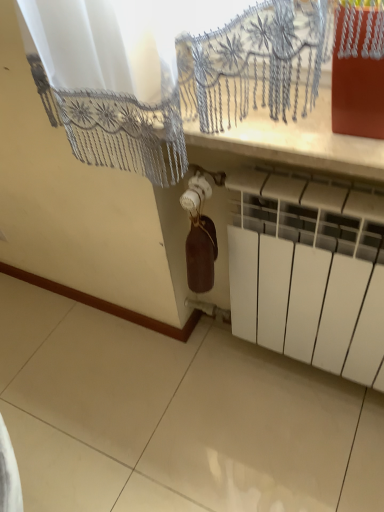
Question: Should I look upward or downward to see brown matte wine bottle at center?

Choices:
 (A) down
 (B) up

Answer: (B)

Question: Does white matte radiator at lower right have a greater width compared to brown matte wine bottle at center?

Choices:
 (A) yes
 (B) no

Answer: (A)

Question: Does white matte radiator at lower right lie in front of brown matte wine bottle at center?

Choices:
 (A) yes
 (B) no

Answer: (A)

Question: Does white matte radiator at lower right appear on the left side of brown matte wine bottle at center?

Choices:
 (A) no
 (B) yes

Answer: (A)

Question: Does white matte radiator at lower right have a greater height compared to brown matte wine bottle at center?

Choices:
 (A) yes
 (B) no

Answer: (A)

Question: From a real-world perspective, is white matte radiator at lower right under brown matte wine bottle at center?

Choices:
 (A) yes
 (B) no

Answer: (A)

Question: Can you confirm if white matte radiator at lower right is shorter than brown matte wine bottle at center?

Choices:
 (A) no
 (B) yes

Answer: (A)

Question: Is brown matte wine bottle at center turned away from white matte radiator at lower right?

Choices:
 (A) yes
 (B) no

Answer: (A)

Question: Is brown matte wine bottle at center oriented towards white matte radiator at lower right?

Choices:
 (A) no
 (B) yes

Answer: (B)

Question: From the image's perspective, is brown matte wine bottle at center on white matte radiator at lower right?

Choices:
 (A) yes
 (B) no

Answer: (A)

Question: Does brown matte wine bottle at center lie in front of white matte radiator at lower right?

Choices:
 (A) no
 (B) yes

Answer: (A)

Question: From a real-world perspective, is brown matte wine bottle at center positioned under white matte radiator at lower right based on gravity?

Choices:
 (A) no
 (B) yes

Answer: (A)

Question: Is brown matte wine bottle at center next to white matte radiator at lower right and touching it?

Choices:
 (A) yes
 (B) no

Answer: (B)

Question: Considering the positions of point (198, 273) and point (322, 343), is point (198, 273) closer or farther from the camera than point (322, 343)?

Choices:
 (A) farther
 (B) closer

Answer: (B)